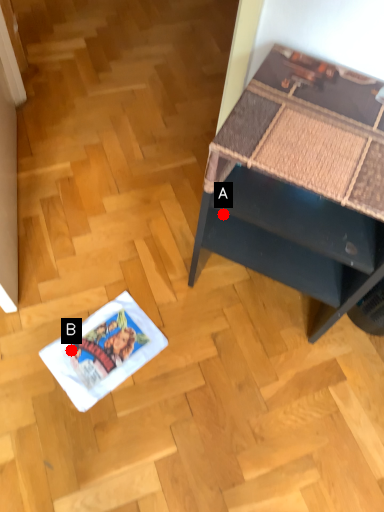
Question: Two points are circled on the image, labeled by A and B beside each circle. Which point is farther to the camera?

Choices:
 (A) A is further
 (B) B is further

Answer: (B)